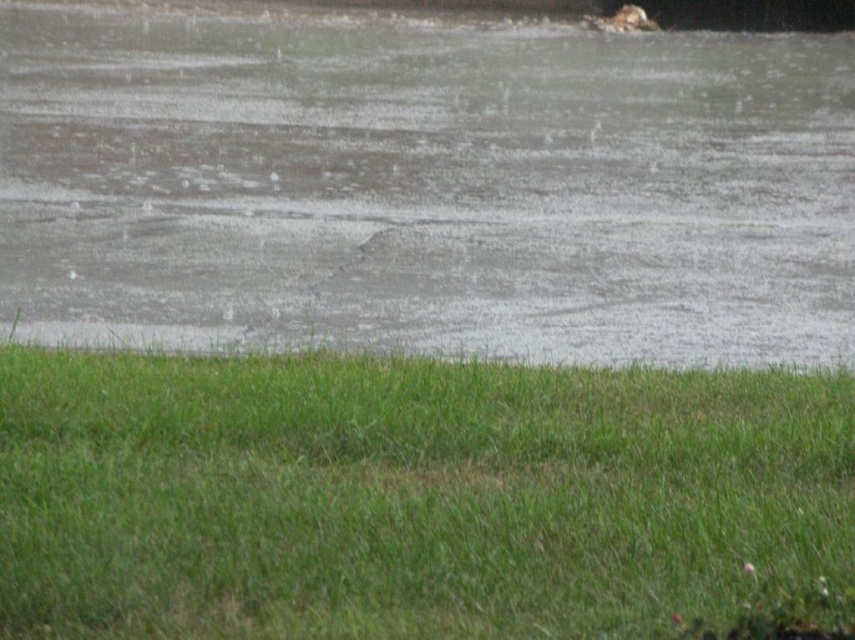
Question: Does gray matte water at center come in front of green grass at lower center?

Choices:
 (A) no
 (B) yes

Answer: (A)

Question: Does gray matte water at center appear under green grass at lower center?

Choices:
 (A) yes
 (B) no

Answer: (B)

Question: Among these objects, which one is nearest to the camera?

Choices:
 (A) green grass at lower center
 (B) gray matte water at center

Answer: (A)

Question: Among these points, which one is nearest to the camera?

Choices:
 (A) (381, 44)
 (B) (680, 420)

Answer: (B)

Question: Can you confirm if gray matte water at center is wider than green grass at lower center?

Choices:
 (A) no
 (B) yes

Answer: (B)